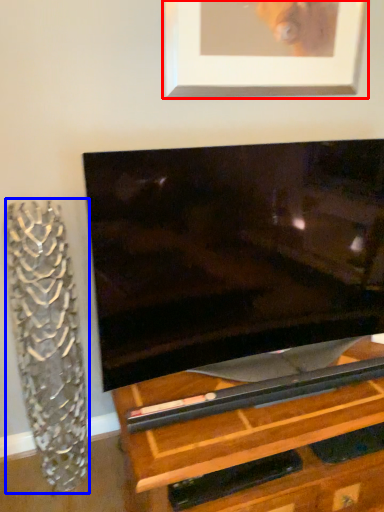
Question: Which point is closer to the camera, picture frame (highlighted by a red box) or glass vase (highlighted by a blue box)?

Choices:
 (A) picture frame
 (B) glass vase

Answer: (B)